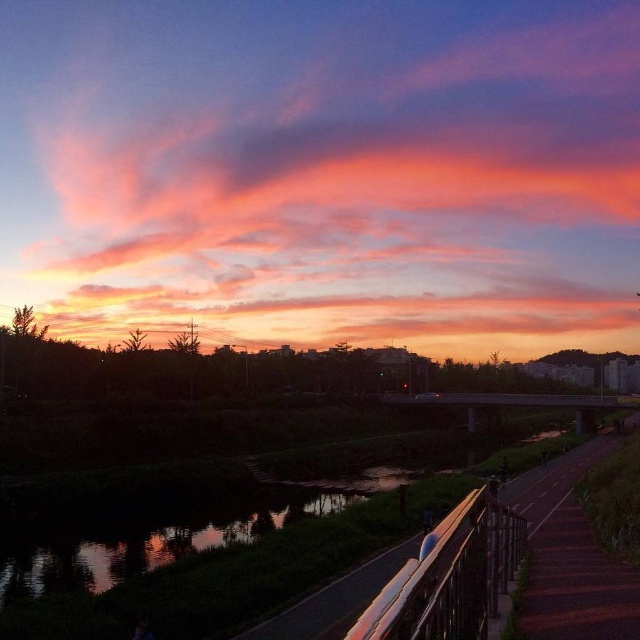
You are a photographer planning to capture the sunset reflections on the reflective glass water at center. To ensure the smooth asphalt path at lower right doesn not block the view, how should you position yourself?

The smooth asphalt path at lower right is larger in size than the reflective glass water at center, so to avoid blocking the view, position yourself further away from the path to frame the smaller reflective glass water at center more prominently.